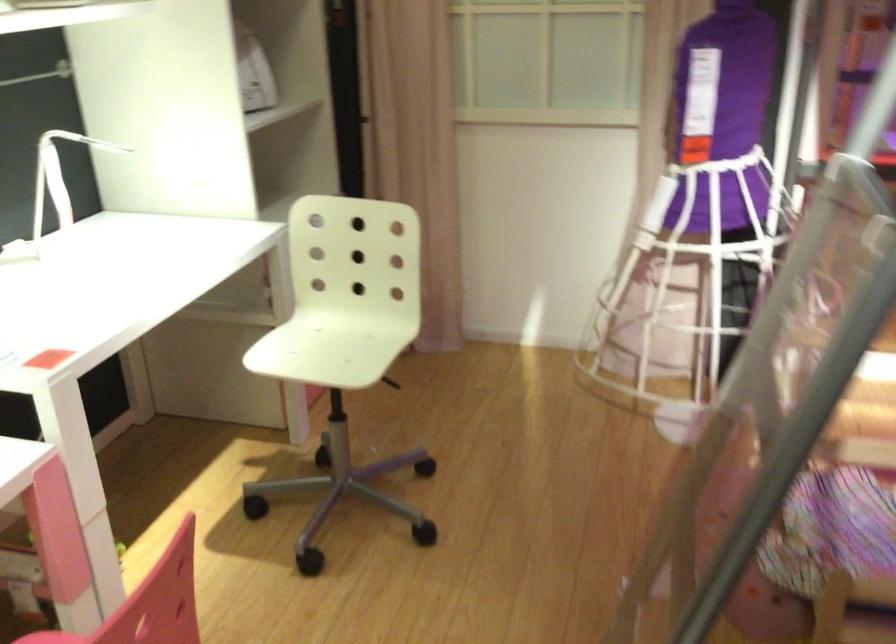
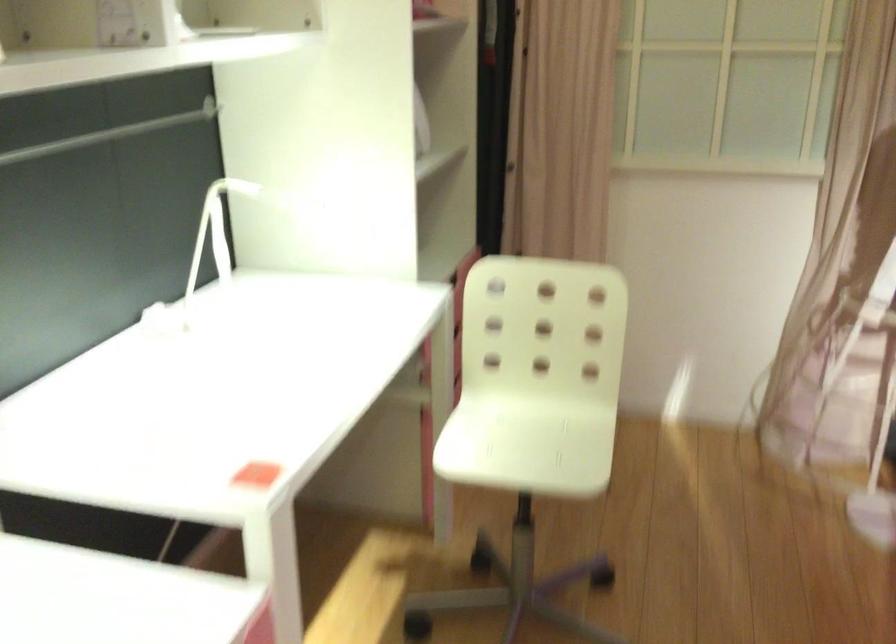
Which direction would the cameraman need to move to produce the second image?

The cameraman moved toward left, forward.